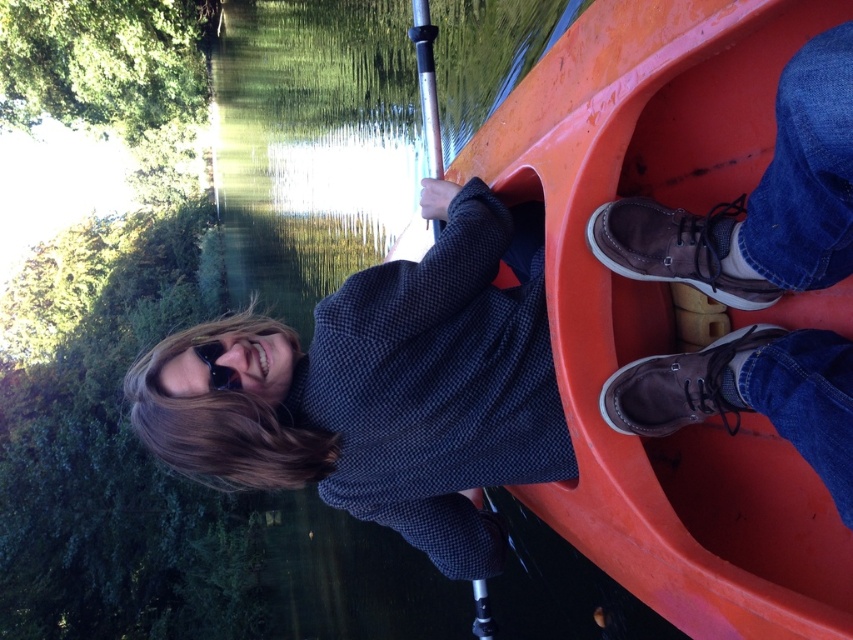
You are a photographer trying to capture a closeup shot of the dark blue sweater at center and the silver metallic paddle at center. If you want to ensure both items are fully visible in your shot without cropping, which item requires more horizontal space in the frame?

The dark blue sweater at center requires more horizontal space in the frame because its width surpasses that of the silver metallic paddle at center.

Based on the photo, you are a photographer trying to capture a clear shot of both the dark blue sweater at center and the brown suede shoes at lower right. However, you notice that one of these items is partially blocking the other. Which item is being blocked, and by which one?

The brown suede shoes at lower right are behind the dark blue sweater at center, so the dark blue sweater at center is blocking the brown suede shoes at lower right.

You are a photographer trying to capture a photo of the orange matte plastic boat at center and the silver metallic paddle at center. Based on their positions, which object should you focus on first if you want to ensure both are in sharp focus?

The orange matte plastic boat at center is located below the silver metallic paddle at center. Since the boat is lower in the frame, you should focus on the silver metallic paddle at center first, then adjust to capture the boat below it.